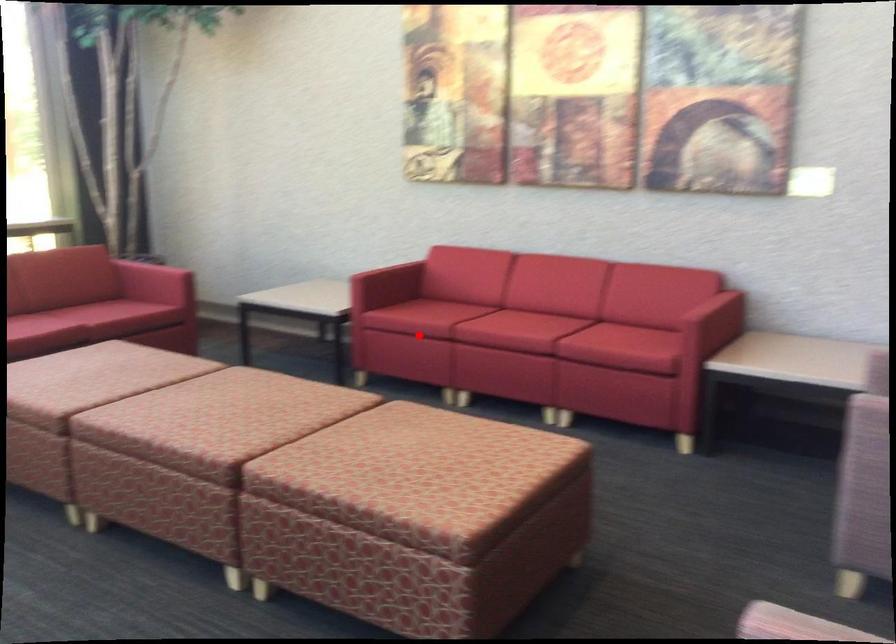
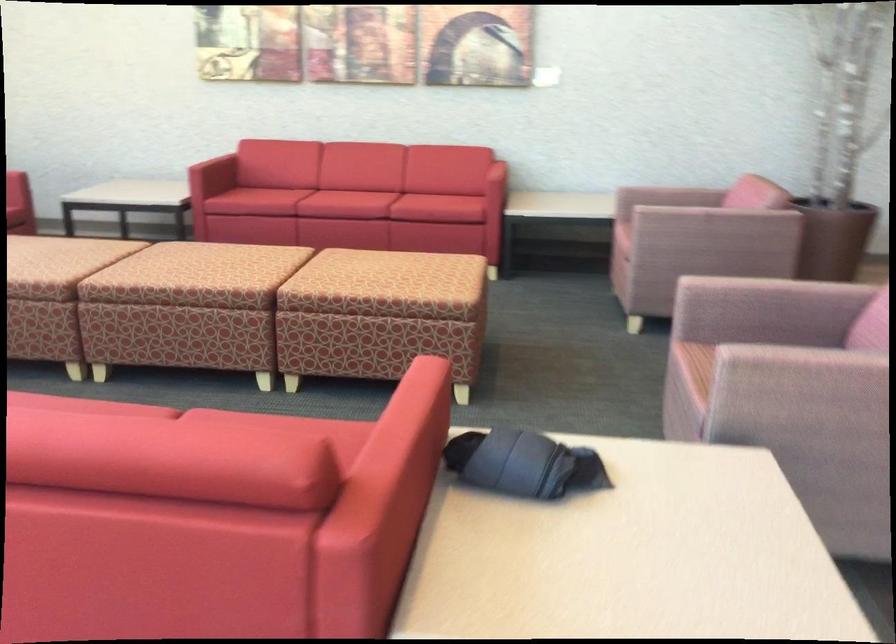
Question: I am providing you with two images of the same scene from different viewpoints. A red point is shown in image1. For the corresponding object point in image2, is it positioned nearer or farther from the camera?

Choices:
 (A) Nearer
 (B) Farther

Answer: (B)